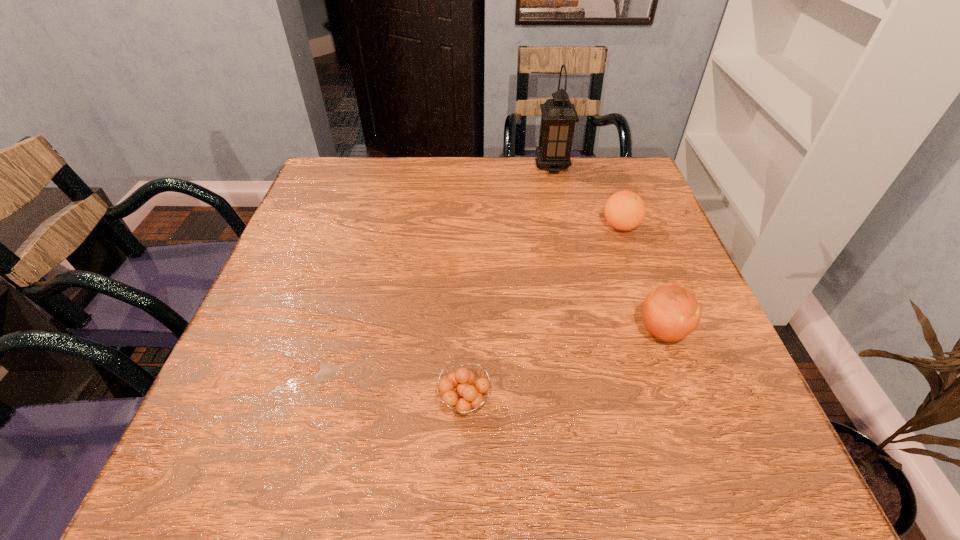
The height and width of the screenshot is (540, 960). I want to click on free space located on the left of the second tallest orange fruit, so click(x=553, y=226).

Where is `vacant area located on the right of the nearest orange fruit`? vacant area located on the right of the nearest orange fruit is located at coordinates (632, 401).

Identify the location of object that is positioned at the far edge. (559, 116).

The image size is (960, 540). I want to click on vacant space at the far edge of the desktop, so [392, 193].

This screenshot has width=960, height=540. What are the coordinates of `vacant space at the near edge of the desktop` in the screenshot? It's located at (408, 463).

The image size is (960, 540). What are the coordinates of `vacant region at the left edge of the desktop` in the screenshot? It's located at (331, 219).

Image resolution: width=960 pixels, height=540 pixels. In the image, there is a desktop. In order to click on free space at the right edge in this screenshot , I will do `click(708, 392)`.

The width and height of the screenshot is (960, 540). In order to click on free space at the far left corner of the desktop in this screenshot , I will do coord(360,166).

In the image, there is a desktop. Identify the location of vacant space at the near left corner. (278, 469).

In the image, there is a desktop. Where is `vacant space at the far right corner`? vacant space at the far right corner is located at coordinates (643, 181).